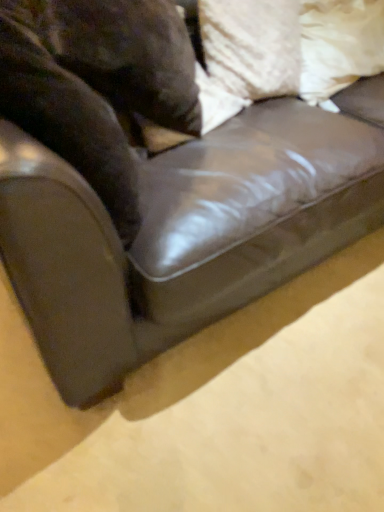
Question: Could you tell me if brown fur at left is turned towards white fabric pillow at upper right, the 2th pillow when ordered from left to right?

Choices:
 (A) yes
 (B) no

Answer: (A)

Question: Considering the relative positions of brown fur at left and white fabric pillow at upper right, which is the first pillow in right-to-left order, in the image provided, is brown fur at left to the left of white fabric pillow at upper right, which is the first pillow in right-to-left order, from the viewer's perspective?

Choices:
 (A) no
 (B) yes

Answer: (B)

Question: Considering the relative sizes of brown fur at left and white fabric pillow at upper right, the 2th pillow when ordered from left to right, in the image provided, is brown fur at left wider than white fabric pillow at upper right, the 2th pillow when ordered from left to right,?

Choices:
 (A) no
 (B) yes

Answer: (A)

Question: Can you confirm if brown fur at left is bigger than white fabric pillow at upper right, which is the first pillow in right-to-left order?

Choices:
 (A) yes
 (B) no

Answer: (A)

Question: Is brown fur at left not within white fabric pillow at upper right, the 2th pillow when ordered from left to right?

Choices:
 (A) no
 (B) yes

Answer: (B)

Question: Is brown fur at left looking in the opposite direction of white fabric pillow at upper right, the 2th pillow when ordered from left to right?

Choices:
 (A) yes
 (B) no

Answer: (B)

Question: Is white fabric pillow at upper right, which is the first pillow in right-to-left order, taller than white textured pillow at upper right, acting as the second pillow starting from the right?

Choices:
 (A) no
 (B) yes

Answer: (B)

Question: Is white fabric pillow at upper right, the 2th pillow when ordered from left to right, shorter than white textured pillow at upper right, the 1th pillow when ordered from left to right?

Choices:
 (A) yes
 (B) no

Answer: (B)

Question: Is white fabric pillow at upper right, the 2th pillow when ordered from left to right, aimed at white textured pillow at upper right, acting as the second pillow starting from the right?

Choices:
 (A) no
 (B) yes

Answer: (A)

Question: Would you consider white fabric pillow at upper right, the 2th pillow when ordered from left to right, to be distant from white textured pillow at upper right, the 1th pillow when ordered from left to right?

Choices:
 (A) yes
 (B) no

Answer: (B)

Question: From the image's perspective, would you say white fabric pillow at upper right, the 2th pillow when ordered from left to right, is positioned over white textured pillow at upper right, acting as the second pillow starting from the right?

Choices:
 (A) yes
 (B) no

Answer: (A)

Question: From the image's perspective, does white fabric pillow at upper right, the 2th pillow when ordered from left to right, appear lower than white textured pillow at upper right, the 1th pillow when ordered from left to right?

Choices:
 (A) yes
 (B) no

Answer: (B)

Question: Is white textured pillow at upper right, acting as the second pillow starting from the right, in front of white fabric pillow at upper right, the 2th pillow when ordered from left to right?

Choices:
 (A) yes
 (B) no

Answer: (A)